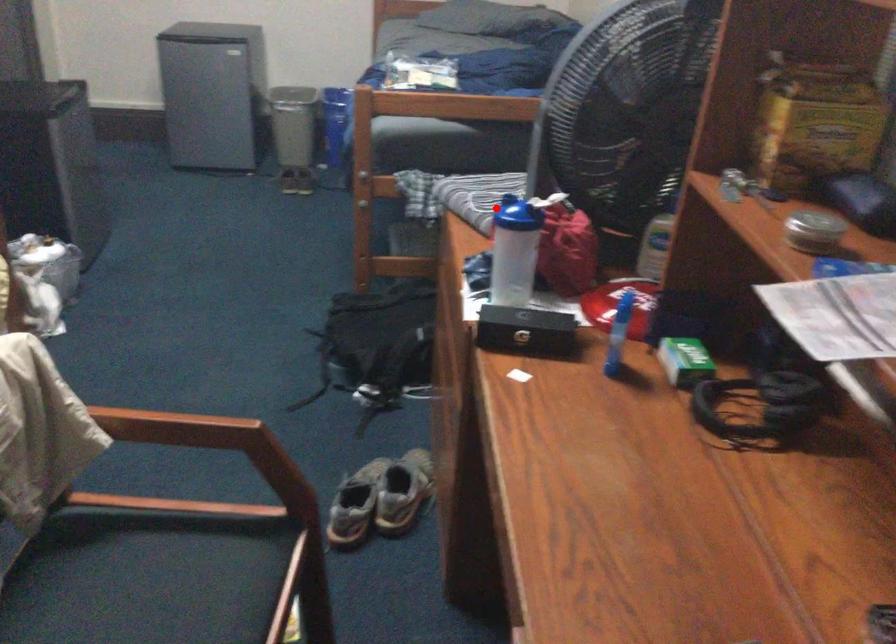
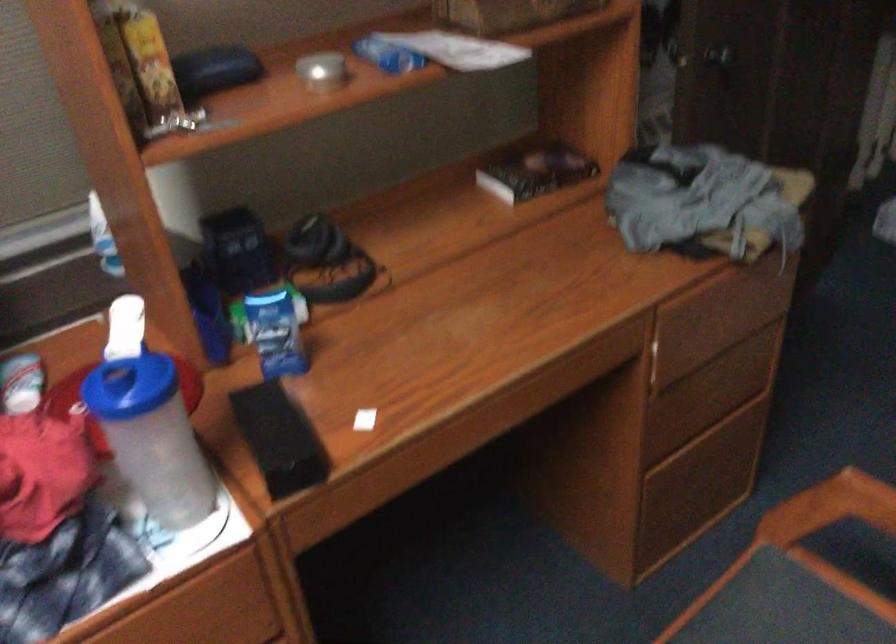
Find the pixel in the second image that matches the highlighted location in the first image.

(130, 386)